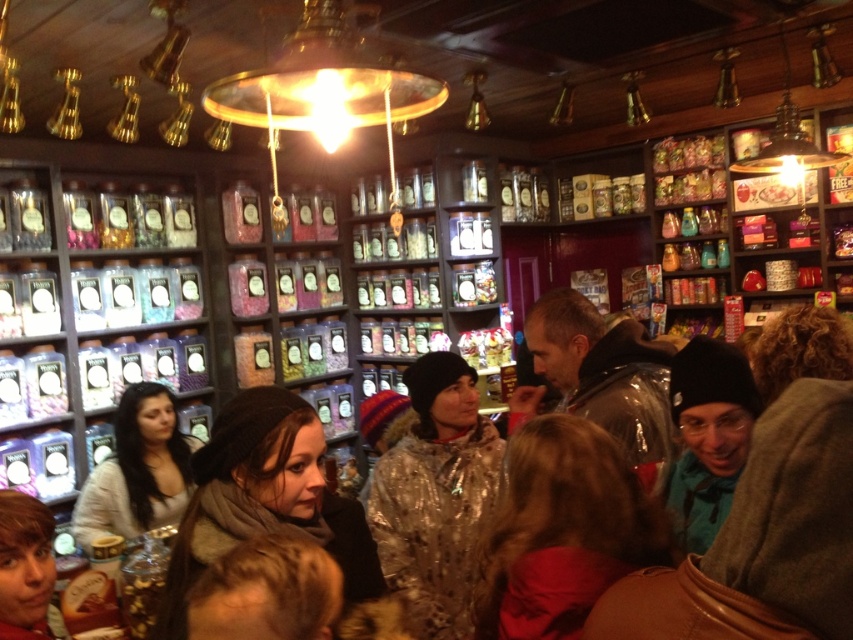
Is point (584, 321) less distant than point (312, 564)?

No, (584, 321) is behind (312, 564).

Is point (656, 419) positioned after point (286, 554)?

Yes, point (656, 419) is farther from viewer.

Is point (625, 385) positioned in front of point (294, 636)?

That is False.

I want to click on glossy black jacket at center, so [605, 372].

Can you confirm if knitted sweater at center is shorter than smooth brown hair at lower left?

In fact, knitted sweater at center may be taller than smooth brown hair at lower left.

Between knitted sweater at center and smooth brown hair at lower left, which one appears on the left side from the viewer's perspective?

knitted sweater at center

Between point (140, 518) and point (10, 556), which one is positioned behind?

Point (140, 518)

The image size is (853, 640). What are the coordinates of `knitted sweater at center` in the screenshot? It's located at (137, 470).

Is glossy black jacket at center closer to the viewer compared to smooth brown hair at lower left?

That is False.

Can you confirm if glossy black jacket at center is positioned to the left of smooth brown hair at lower left?

Incorrect, glossy black jacket at center is not on the left side of smooth brown hair at lower left.

Who is more distant from viewer, (x=567, y=388) or (x=10, y=577)?

The point (x=567, y=388) is more distant.

Image resolution: width=853 pixels, height=640 pixels. I want to click on glossy black jacket at center, so click(605, 372).